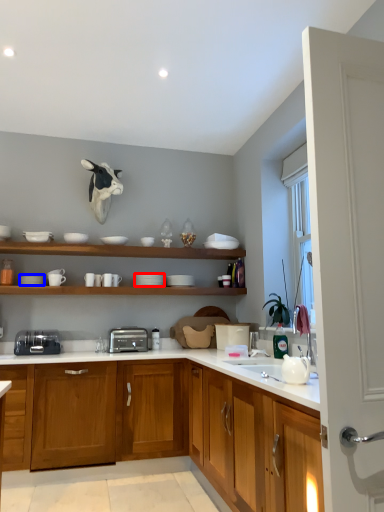
Question: Which point is further to the camera, tableware (highlighted by a red box) or tableware (highlighted by a blue box)?

Choices:
 (A) tableware
 (B) tableware

Answer: (A)